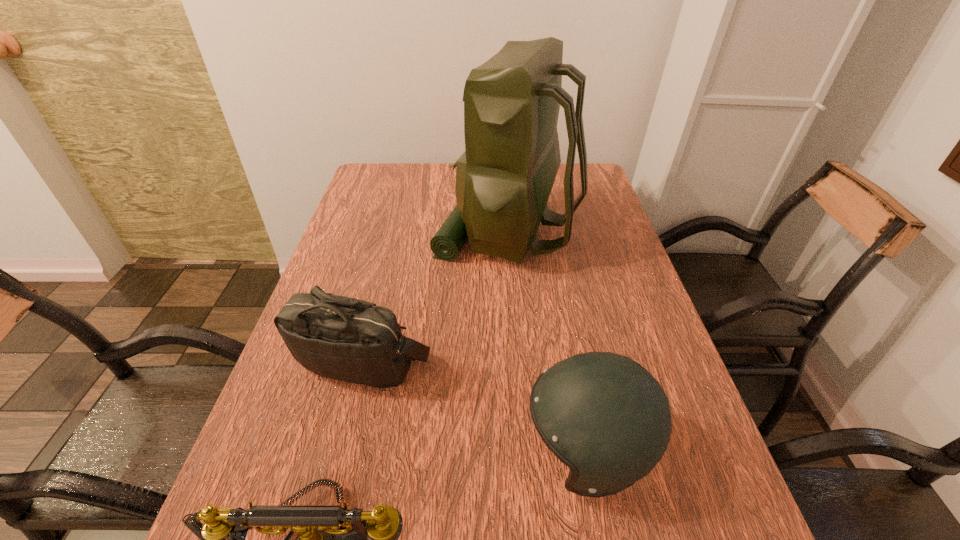
Find the location of `vacant area situated at the front padded panel of the second farthest object`. vacant area situated at the front padded panel of the second farthest object is located at coordinates (331, 483).

Identify the location of object that is positioned at the far edge. This screenshot has width=960, height=540. 504,178.

The height and width of the screenshot is (540, 960). I want to click on object that is at the left edge, so click(356, 341).

Where is `backpack that is at the right edge`? backpack that is at the right edge is located at coordinates (504, 178).

I want to click on football helmet at the right edge, so click(x=603, y=415).

What are the coordinates of `object that is positioned at the far right corner` in the screenshot? It's located at (504, 178).

Find the location of `vacant space at the far edge of the desktop`. vacant space at the far edge of the desktop is located at coordinates (437, 176).

The width and height of the screenshot is (960, 540). In the image, there is a desktop. Find the location of `free space at the left edge`. free space at the left edge is located at coordinates (353, 198).

Find the location of a particular element. The width and height of the screenshot is (960, 540). vacant space at the right edge is located at coordinates (612, 296).

Where is `vacant space at the far right corner`? The width and height of the screenshot is (960, 540). vacant space at the far right corner is located at coordinates [x=576, y=193].